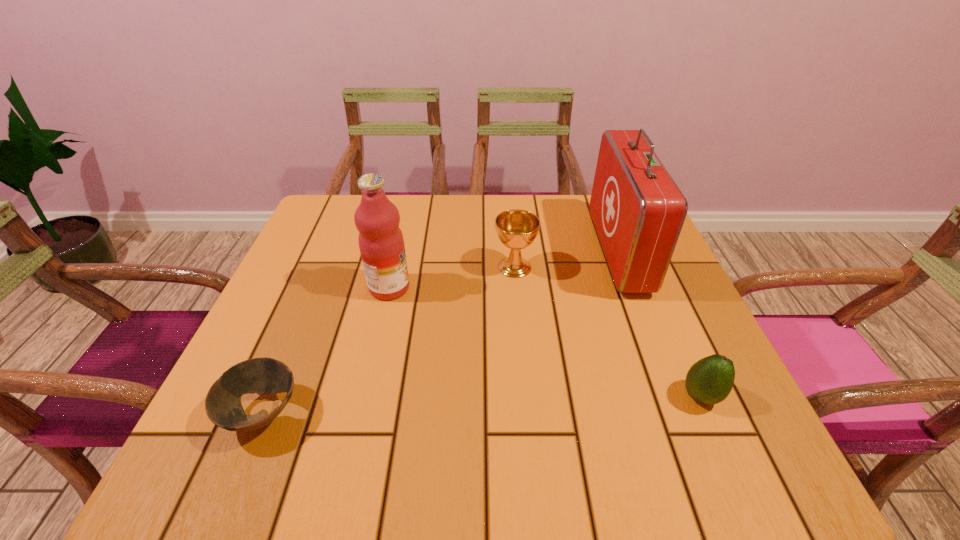
You are a GUI agent. You are given a task and a screenshot of the screen. Output one action in this format:
    pyautogui.click(x=<x>, y=<y>)
    Task: Click on the vacant space that satisfies the following two spatial constraints: 1. on the label of the second object from left to right; 2. on the right side of the second shortest object
    
    Given the screenshot: What is the action you would take?
    pyautogui.click(x=365, y=396)

The height and width of the screenshot is (540, 960). In order to click on vacant space that satisfies the following two spatial constraints: 1. on the back side of the fourth tallest object; 2. on the right side of the shortest object in this screenshot , I will do `click(270, 396)`.

You are a GUI agent. You are given a task and a screenshot of the screen. Output one action in this format:
    pyautogui.click(x=<x>, y=<y>)
    Task: Click on the blank space that satisfies the following two spatial constraints: 1. on the label of the avocado; 2. on the right side of the second object from left to right
    
    Given the screenshot: What is the action you would take?
    pyautogui.click(x=365, y=396)

This screenshot has height=540, width=960. Identify the location of vacant space that satisfies the following two spatial constraints: 1. on the label of the fourth object from right to left; 2. on the right side of the avocado. (365, 396).

Image resolution: width=960 pixels, height=540 pixels. What are the coordinates of `free space that satisfies the following two spatial constraints: 1. on the side of the avocado with the first aid cross symbol; 2. on the right side of the first-aid kit` in the screenshot? It's located at (675, 396).